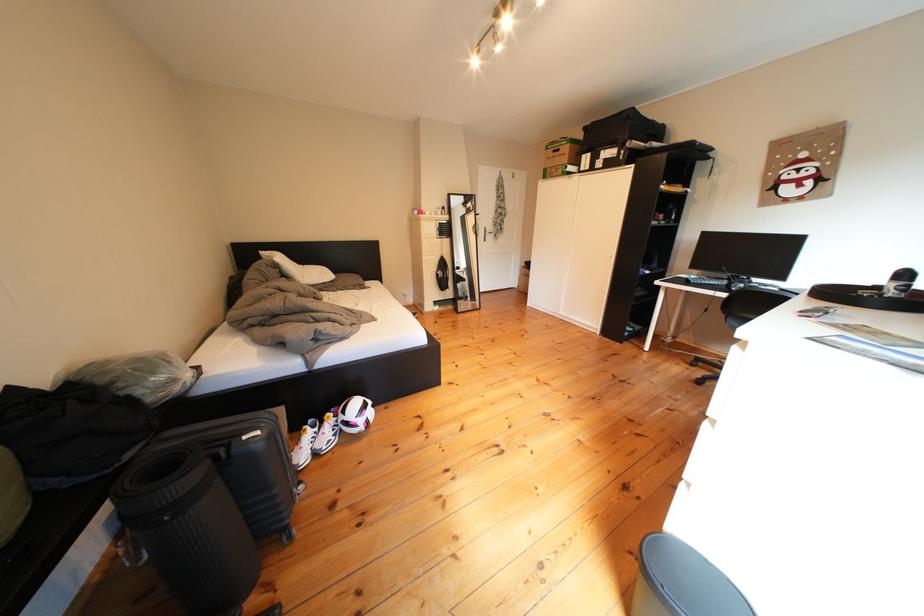
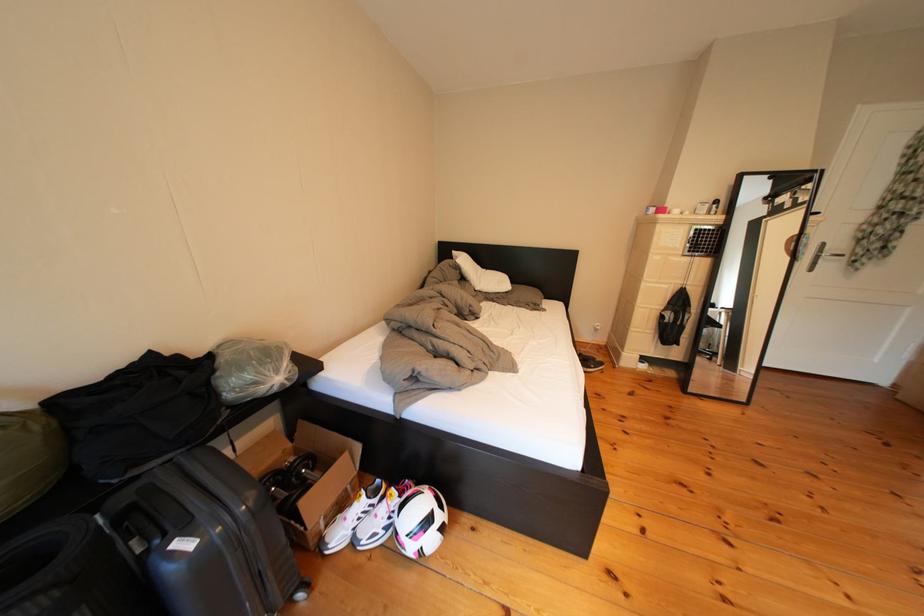
Question: The first image is from the beginning of the video and the second image is from the end. How did the camera likely rotate when shooting the video?

Choices:
 (A) Left
 (B) Right
 (C) Up
 (D) Down

Answer: (A)